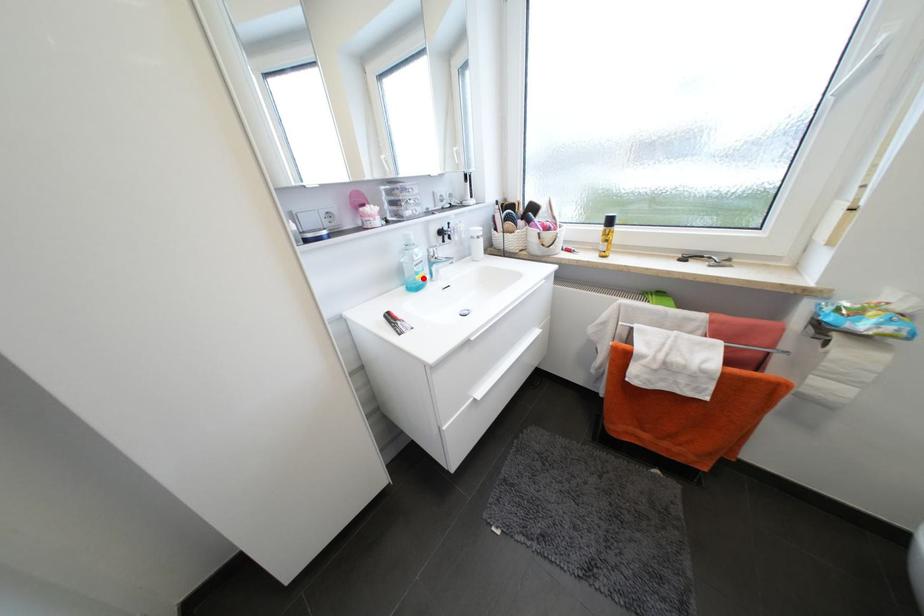
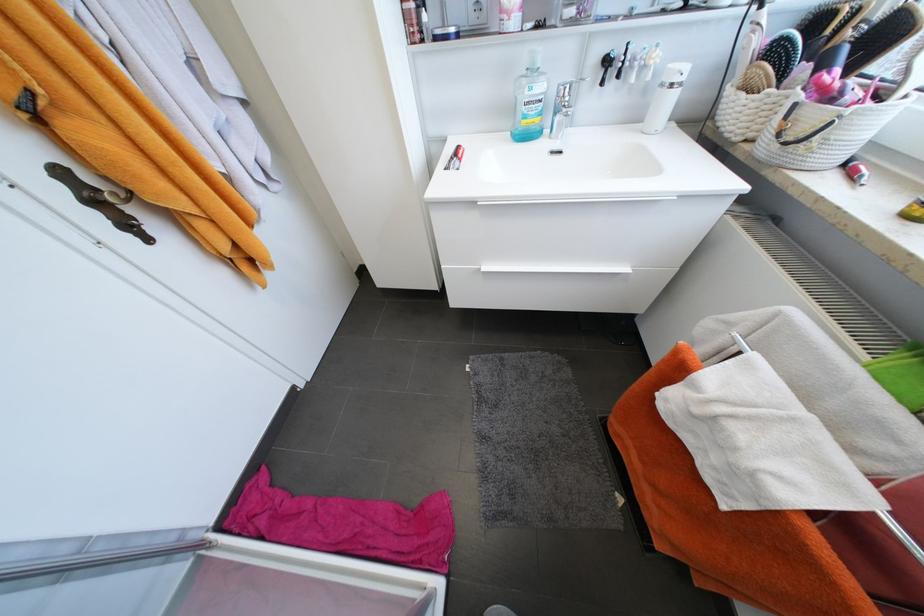
Locate, in the second image, the point that corresponds to the highlighted location in the first image.

(529, 123)